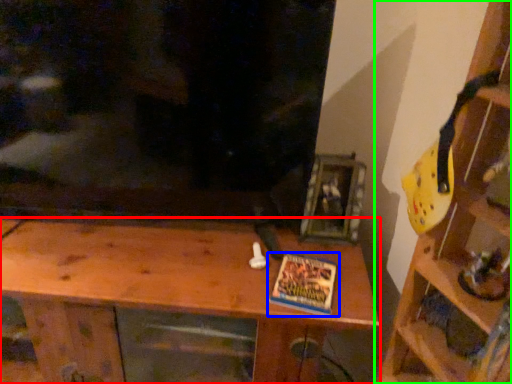
Question: Based on their relative distances, which object is nearer to shelf (highlighted by a red box)? Choose from book (highlighted by a blue box) and shelf (highlighted by a green box).

Choices:
 (A) book
 (B) shelf

Answer: (A)